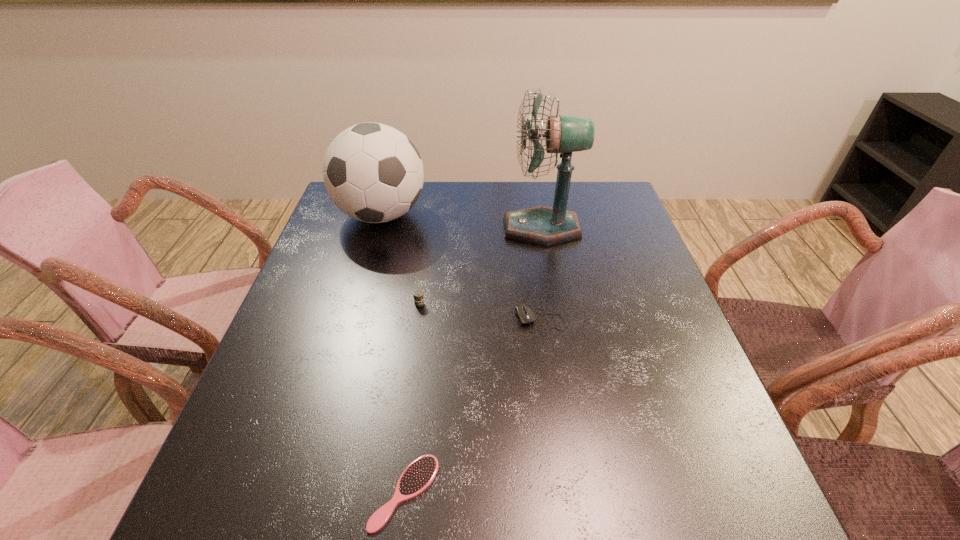
Where is `free point between the hairbrush and the computer mouse`? free point between the hairbrush and the computer mouse is located at coordinates (472, 407).

You are a GUI agent. You are given a task and a screenshot of the screen. Output one action in this format:
    pyautogui.click(x=<x>, y=<y>)
    Task: Click on the vacant area that lies between the beer can and the second shortest object
    The width and height of the screenshot is (960, 540).
    Given the screenshot: What is the action you would take?
    pyautogui.click(x=480, y=313)

The height and width of the screenshot is (540, 960). I want to click on empty location between the beer can and the tallest object, so click(481, 266).

Identify the location of unoccupied area between the beer can and the shortest object. The height and width of the screenshot is (540, 960). (412, 398).

Find the location of a particular element. The image size is (960, 540). free point between the soccer ball and the beer can is located at coordinates (400, 260).

Locate an element on the screen. Image resolution: width=960 pixels, height=540 pixels. vacant region between the computer mouse and the soccer ball is located at coordinates (461, 268).

Select which object is the closest to the fourth tallest object. Please provide its 2D coordinates. Your answer should be formatted as a tuple, i.e. [(x, y)], where the tuple contains the x and y coordinates of a point satisfying the conditions above.

[(418, 295)]

Identify which object is the second nearest to the computer mouse. Please provide its 2D coordinates. Your answer should be formatted as a tuple, i.e. [(x, y)], where the tuple contains the x and y coordinates of a point satisfying the conditions above.

[(541, 225)]

Image resolution: width=960 pixels, height=540 pixels. Identify the location of free point that satisfies the following two spatial constraints: 1. on the front side of the third tallest object; 2. on the left side of the shortest object. (393, 492).

What are the coordinates of `free region that satisfies the following two spatial constraints: 1. on the back side of the fourth tallest object; 2. on the left side of the hairbrush` in the screenshot? It's located at (425, 321).